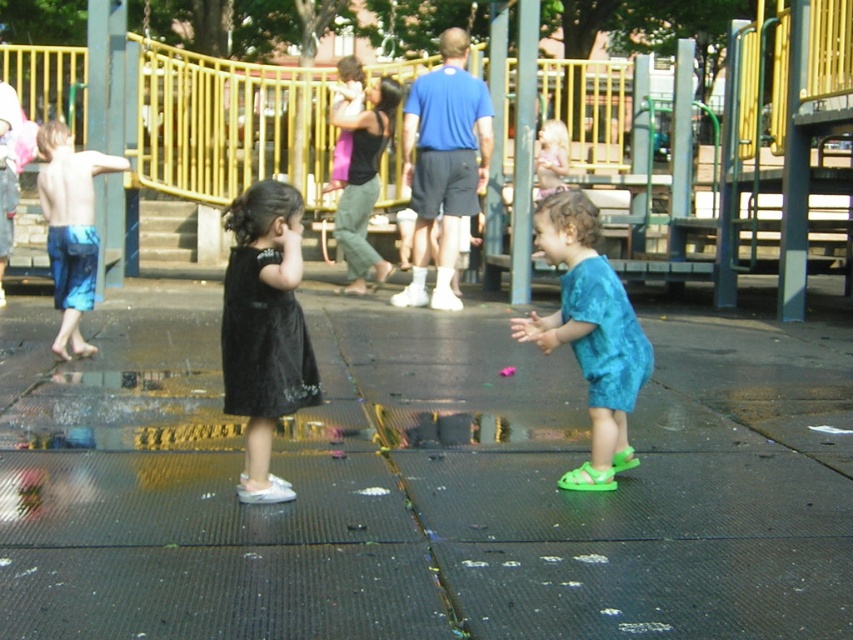
A child is standing on the black rubber pavement at center. If they want to throw a ball to their friend who is standing 4.01 meters away, will the ball land within the playground area?

The ball will land within the playground area because the distance between them is 4.01 meters, which is within the typical playground boundaries.

You are a photographer trying to capture a group photo of the two children wearing the black satin dress at center and the light blue fabric dress at center. You want to ensure both dresses are fully visible in the frame. Which child should you position closer to the camera to avoid cropping either dress?

The black satin dress at center is narrower than the light blue fabric dress at center. Position the child in the light blue fabric dress at center closer to the camera to ensure its wider dress fits within the frame without cropping.